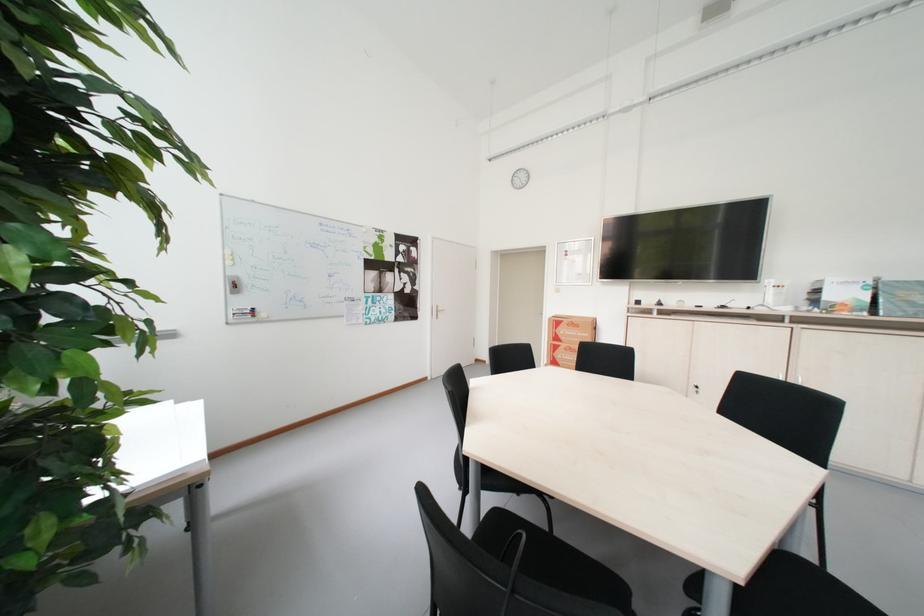
Locate an element on the screen. This screenshot has width=924, height=616. recessed cabinet handle is located at coordinates (694, 390).